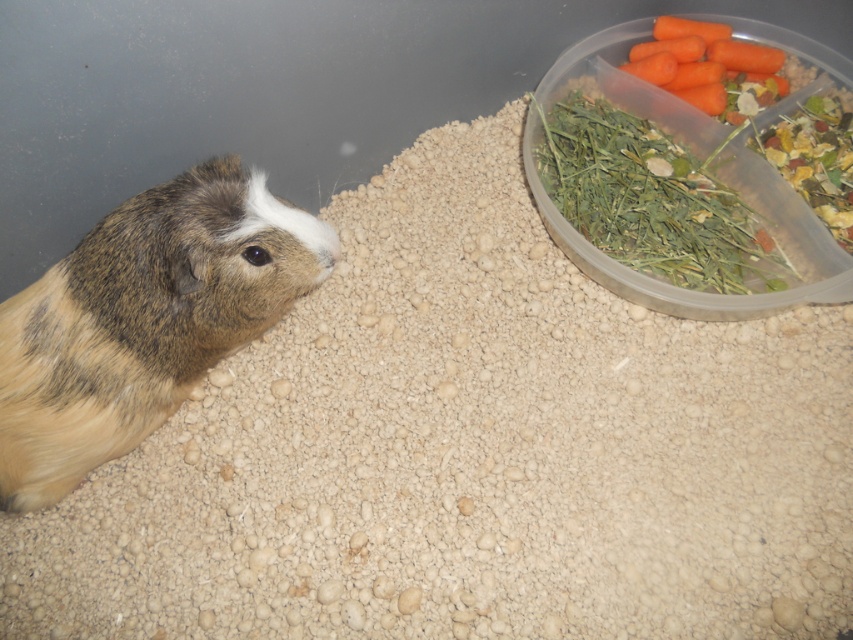
From the picture: Between green leafy hay at upper right and orange matte carrot at upper right, which one has more height?

green leafy hay at upper right

Does green leafy hay at upper right have a greater height compared to orange matte carrot at upper right?

Correct, green leafy hay at upper right is much taller as orange matte carrot at upper right.

Is point (563, 109) positioned before point (689, 48)?

No, it is not.

Locate an element on the screen. This screenshot has height=640, width=853. green leafy hay at upper right is located at coordinates (650, 200).

Does brown fur hamster at left come behind orange matte carrot at upper right?

No, brown fur hamster at left is in front of orange matte carrot at upper right.

Can you confirm if brown fur hamster at left is positioned above orange matte carrot at upper right?

No.

The height and width of the screenshot is (640, 853). Identify the location of brown fur hamster at left. (143, 320).

Who is lower down, brown fur hamster at left or green leafy hay at upper right?

brown fur hamster at left is lower down.

The height and width of the screenshot is (640, 853). What do you see at coordinates (143, 320) in the screenshot?
I see `brown fur hamster at left` at bounding box center [143, 320].

The image size is (853, 640). Find the location of `brown fur hamster at left`. brown fur hamster at left is located at coordinates (143, 320).